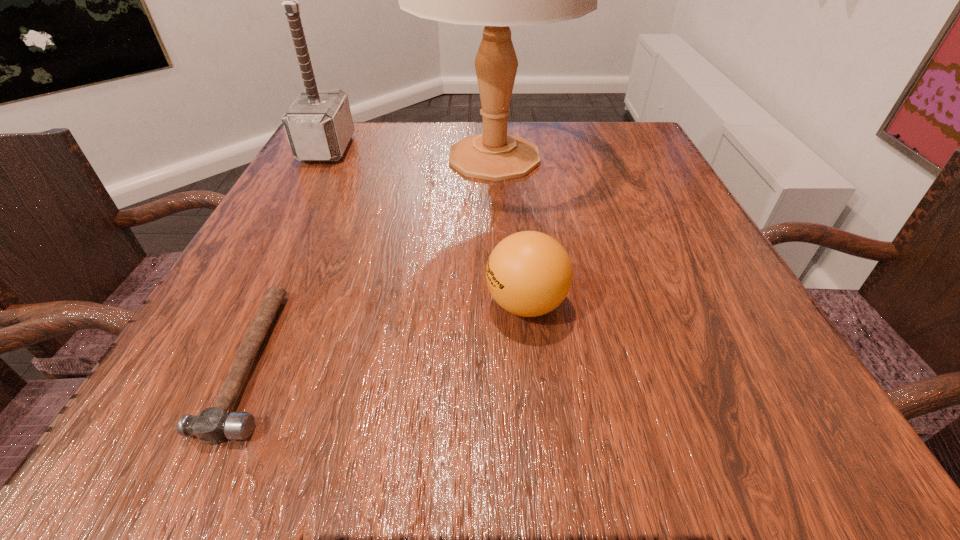
Locate an element on the screen. the tallest object is located at coordinates click(496, 0).

Where is `the third shortest object`? The height and width of the screenshot is (540, 960). the third shortest object is located at coordinates (319, 125).

The image size is (960, 540). I want to click on the farther hammer, so click(x=319, y=125).

You are a GUI agent. You are given a task and a screenshot of the screen. Output one action in this format:
    pyautogui.click(x=<x>, y=<y>)
    Task: Click on the ping-pong ball
    The width and height of the screenshot is (960, 540).
    Given the screenshot: What is the action you would take?
    tap(529, 273)

In order to click on the nearer hammer in this screenshot , I will do click(x=212, y=425).

This screenshot has width=960, height=540. In order to click on the shortest object in this screenshot , I will do pos(212,425).

Where is `vacant area located 0.170m on the right of the tallest object`? This screenshot has height=540, width=960. vacant area located 0.170m on the right of the tallest object is located at coordinates (651, 158).

You are a GUI agent. You are given a task and a screenshot of the screen. Output one action in this format:
    pyautogui.click(x=<x>, y=<y>)
    Task: Click on the vacant region located for striking with the head of the taller hammer
    This screenshot has height=540, width=960.
    Given the screenshot: What is the action you would take?
    pyautogui.click(x=492, y=148)

Identify the location of free space located on the side with brand of the third tallest object. The height and width of the screenshot is (540, 960). (253, 303).

The width and height of the screenshot is (960, 540). Identify the location of vacant space situated on the side with brand of the third tallest object. (247, 303).